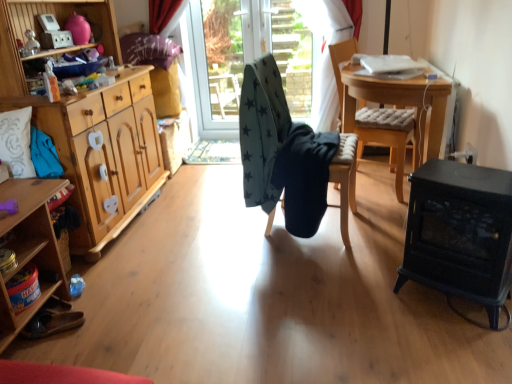
Where is `vacant area in front of black cast iron fireplace at lower right`? vacant area in front of black cast iron fireplace at lower right is located at coordinates (459, 345).